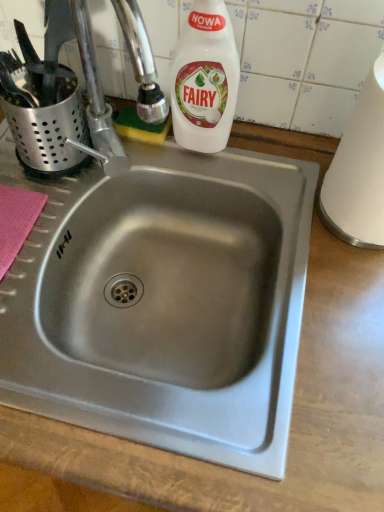
What do you see at coordinates (205, 79) in the screenshot?
I see `white plastic bottle at upper center` at bounding box center [205, 79].

The width and height of the screenshot is (384, 512). What are the coordinates of `white plastic bottle at upper center` in the screenshot? It's located at (205, 79).

What is the approximate height of white matte paper towel at right?

white matte paper towel at right is 30.40 centimeters tall.

Where is `white matte paper towel at right`? Image resolution: width=384 pixels, height=512 pixels. white matte paper towel at right is located at coordinates (359, 170).

The width and height of the screenshot is (384, 512). What do you see at coordinates (359, 170) in the screenshot? I see `white matte paper towel at right` at bounding box center [359, 170].

Looking at this image, measure the distance between white matte paper towel at right and camera.

white matte paper towel at right is 19.07 inches away from camera.

You are a GUI agent. You are given a task and a screenshot of the screen. Output one action in this format:
    pyautogui.click(x=<x>, y=<y>)
    Task: Click on the white plastic bottle at upper center
    The width and height of the screenshot is (384, 512).
    Given the screenshot: What is the action you would take?
    pyautogui.click(x=205, y=79)

Is white matte paper towel at right to the left of white plastic bottle at upper center from the viewer's perspective?

Incorrect, white matte paper towel at right is not on the left side of white plastic bottle at upper center.

Which object is further away from the camera taking this photo, white matte paper towel at right or white plastic bottle at upper center?

Positioned behind is white plastic bottle at upper center.

Considering the points (326, 184) and (229, 22), which point is behind, point (326, 184) or point (229, 22)?

Point (326, 184)

From the image's perspective, is white matte paper towel at right beneath white plastic bottle at upper center?

Yes.

Looking at this image, from a real-world perspective, is white matte paper towel at right positioned above or below white plastic bottle at upper center?

In terms of real-world spatial position, white matte paper towel at right is above white plastic bottle at upper center.

In terms of width, does white matte paper towel at right look wider or thinner when compared to white plastic bottle at upper center?

In the image, white matte paper towel at right appears to be wider than white plastic bottle at upper center.

Considering the sizes of objects white matte paper towel at right and white plastic bottle at upper center in the image provided, who is taller, white matte paper towel at right or white plastic bottle at upper center?

With more height is white matte paper towel at right.

Is white matte paper towel at right smaller than white plastic bottle at upper center?

No.

Would you say white matte paper towel at right contains white plastic bottle at upper center?

No, white plastic bottle at upper center is located outside of white matte paper towel at right.

Is white matte paper towel at right next to white plastic bottle at upper center?

They are not placed beside each other.

Is white matte paper towel at right facing away from white plastic bottle at upper center?

That's not correct — white matte paper towel at right is not looking away from white plastic bottle at upper center.

Can you tell me how much white matte paper towel at right and white plastic bottle at upper center differ in facing direction?

The angular difference between white matte paper towel at right and white plastic bottle at upper center is 0.938 degrees.

This screenshot has height=512, width=384. I want to click on cleaning product located above the white matte paper towel at right (from the image's perspective), so click(205, 79).

Is white plastic bottle at upper center to the left of white matte paper towel at right from the viewer's perspective?

Correct, you'll find white plastic bottle at upper center to the left of white matte paper towel at right.

Is the depth of white plastic bottle at upper center greater than that of white matte paper towel at right?

Yes, white plastic bottle at upper center is behind white matte paper towel at right.

Considering the points (189, 144) and (372, 136), which point is behind, point (189, 144) or point (372, 136)?

Point (189, 144)

From the image's perspective, who appears lower, white plastic bottle at upper center or white matte paper towel at right?

white matte paper towel at right is shown below in the image.

From a real-world perspective, is white plastic bottle at upper center positioned above or below white matte paper towel at right?

white plastic bottle at upper center is below white matte paper towel at right.

Consider the image. In terms of width, does white plastic bottle at upper center look wider or thinner when compared to white matte paper towel at right?

Considering their sizes, white plastic bottle at upper center looks slimmer than white matte paper towel at right.

Which of these two, white plastic bottle at upper center or white matte paper towel at right, stands taller?

Standing taller between the two is white matte paper towel at right.

In the scene shown: Is white plastic bottle at upper center bigger or smaller than white matte paper towel at right?

Considering their sizes, white plastic bottle at upper center takes up less space than white matte paper towel at right.

In the scene shown: Is white plastic bottle at upper center spatially inside white matte paper towel at right, or outside of it?

white plastic bottle at upper center lies outside white matte paper towel at right.

Is white plastic bottle at upper center placed right next to white matte paper towel at right?

No, white plastic bottle at upper center is not making contact with white matte paper towel at right.

Is white plastic bottle at upper center aimed at white matte paper towel at right?

No, white plastic bottle at upper center does not turn towards white matte paper towel at right.

This screenshot has height=512, width=384. Identify the location of paper towel in front of the white plastic bottle at upper center. (359, 170).

This screenshot has width=384, height=512. I want to click on cleaning product below the white matte paper towel at right (from a real-world perspective), so click(x=205, y=79).

The height and width of the screenshot is (512, 384). Identify the location of cleaning product located on the left of white matte paper towel at right. (205, 79).